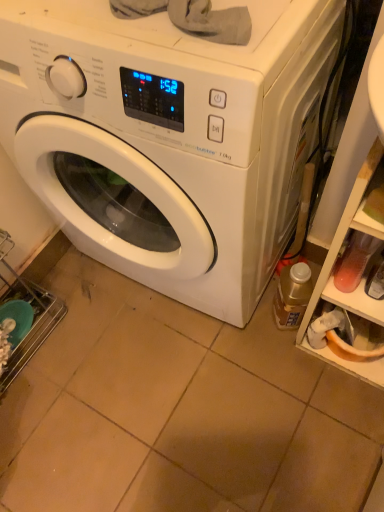
Question: Is translucent plastic bottle at lower right to the left of translucent plastic shelf at right from the viewer's perspective?

Choices:
 (A) no
 (B) yes

Answer: (B)

Question: Is translucent plastic bottle at lower right positioned behind translucent plastic shelf at right?

Choices:
 (A) yes
 (B) no

Answer: (A)

Question: Is translucent plastic bottle at lower right facing towards translucent plastic shelf at right?

Choices:
 (A) yes
 (B) no

Answer: (B)

Question: Is translucent plastic bottle at lower right to the right of translucent plastic shelf at right from the viewer's perspective?

Choices:
 (A) no
 (B) yes

Answer: (A)

Question: Is translucent plastic bottle at lower right beside translucent plastic shelf at right?

Choices:
 (A) yes
 (B) no

Answer: (B)

Question: Is translucent plastic bottle at lower right outside of translucent plastic shelf at right?

Choices:
 (A) yes
 (B) no

Answer: (A)

Question: From a real-world perspective, is translucent plastic bottle at lower right located higher than white glossy washing machine at center?

Choices:
 (A) no
 (B) yes

Answer: (A)

Question: Is the position of translucent plastic bottle at lower right less distant than that of white glossy washing machine at center?

Choices:
 (A) no
 (B) yes

Answer: (A)

Question: Is translucent plastic bottle at lower right oriented towards white glossy washing machine at center?

Choices:
 (A) yes
 (B) no

Answer: (A)

Question: Is the surface of translucent plastic bottle at lower right in direct contact with white glossy washing machine at center?

Choices:
 (A) yes
 (B) no

Answer: (B)

Question: Does translucent plastic bottle at lower right have a smaller size compared to white glossy washing machine at center?

Choices:
 (A) no
 (B) yes

Answer: (B)

Question: Does translucent plastic bottle at lower right contain white glossy washing machine at center?

Choices:
 (A) no
 (B) yes

Answer: (A)

Question: Is white glossy washing machine at center at the right side of translucent plastic bottle at lower right?

Choices:
 (A) no
 (B) yes

Answer: (A)